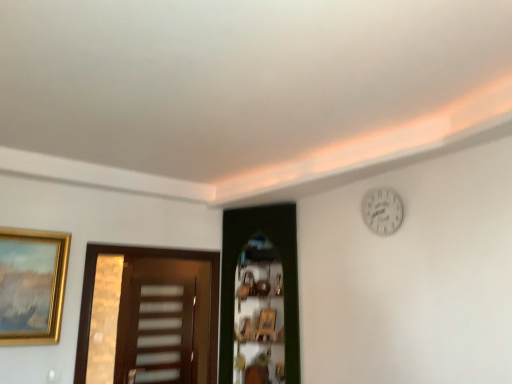
Question: Is green wooden door at center, which ranks as the second door in left-to-right order, at the left side of brown wooden door at left, which appears as the first door when viewed from the left?

Choices:
 (A) yes
 (B) no

Answer: (B)

Question: Considering the relative positions of green wooden door at center, which ranks as the second door in left-to-right order, and brown wooden door at left, the 2th door from the right, in the image provided, is green wooden door at center, which ranks as the second door in left-to-right order, to the right of brown wooden door at left, the 2th door from the right, from the viewer's perspective?

Choices:
 (A) yes
 (B) no

Answer: (A)

Question: Does green wooden door at center, which ranks as the 1th door in right-to-left order, come behind brown wooden door at left, the 2th door from the right?

Choices:
 (A) no
 (B) yes

Answer: (B)

Question: From the image's perspective, is green wooden door at center, which ranks as the second door in left-to-right order, below brown wooden door at left, the 2th door from the right?

Choices:
 (A) yes
 (B) no

Answer: (B)

Question: Can you confirm if green wooden door at center, which ranks as the second door in left-to-right order, is shorter than brown wooden door at left, which appears as the first door when viewed from the left?

Choices:
 (A) no
 (B) yes

Answer: (A)

Question: Is point (375, 211) closer or farther from the camera than point (139, 331)?

Choices:
 (A) closer
 (B) farther

Answer: (A)

Question: Based on their positions, is white matte clock at upper right located to the left or right of translucent plastic screen door at center?

Choices:
 (A) left
 (B) right

Answer: (B)

Question: From a real-world perspective, is white matte clock at upper right positioned above or below translucent plastic screen door at center?

Choices:
 (A) below
 (B) above

Answer: (B)

Question: Based on their sizes in the image, would you say white matte clock at upper right is bigger or smaller than translucent plastic screen door at center?

Choices:
 (A) small
 (B) big

Answer: (A)

Question: Is white matte clock at upper right inside or outside of gold metallic picture frame at left?

Choices:
 (A) inside
 (B) outside

Answer: (B)

Question: In the image, is white matte clock at upper right positioned in front of or behind gold metallic picture frame at left?

Choices:
 (A) front
 (B) behind

Answer: (A)

Question: From a real-world perspective, relative to gold metallic picture frame at left, is white matte clock at upper right vertically above or below?

Choices:
 (A) below
 (B) above

Answer: (B)

Question: From their relative heights in the image, would you say white matte clock at upper right is taller or shorter than gold metallic picture frame at left?

Choices:
 (A) tall
 (B) short

Answer: (B)

Question: Considering the positions of brown wooden door at left, the 2th door from the right, and translucent plastic screen door at center in the image, is brown wooden door at left, the 2th door from the right, bigger or smaller than translucent plastic screen door at center?

Choices:
 (A) small
 (B) big

Answer: (B)

Question: Based on their positions, is brown wooden door at left, which appears as the first door when viewed from the left, located to the left or right of translucent plastic screen door at center?

Choices:
 (A) left
 (B) right

Answer: (B)